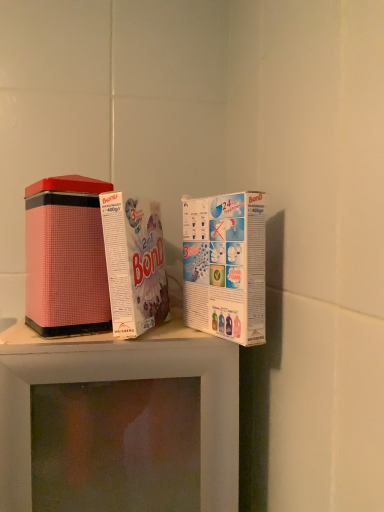
Question: Relative to pink matte tin at center, the 2th product when ordered from left to right, is white cardboard box at upper right, which is counted as the 3th product, starting from the left, in front or behind?

Choices:
 (A) front
 (B) behind

Answer: (A)

Question: From their relative heights in the image, would you say white cardboard box at upper right, which is counted as the 3th product, starting from the left, is taller or shorter than pink matte tin at center, the 2th product when ordered from left to right?

Choices:
 (A) short
 (B) tall

Answer: (A)

Question: Which of these objects is positioned closest to the pink matte tin at center, the 2th product when ordered from left to right?

Choices:
 (A) white cardboard box at upper right, which is counted as the 3th product, starting from the left
 (B) pink matte tin can at left, which is counted as the 3th product, starting from the right

Answer: (A)

Question: Which object is the closest to the white cardboard box at upper right, which is counted as the 3th product, starting from the left?

Choices:
 (A) pink matte tin can at left, positioned as the 1th product in left-to-right order
 (B) pink matte tin at center, the 2th product when ordered from left to right

Answer: (B)